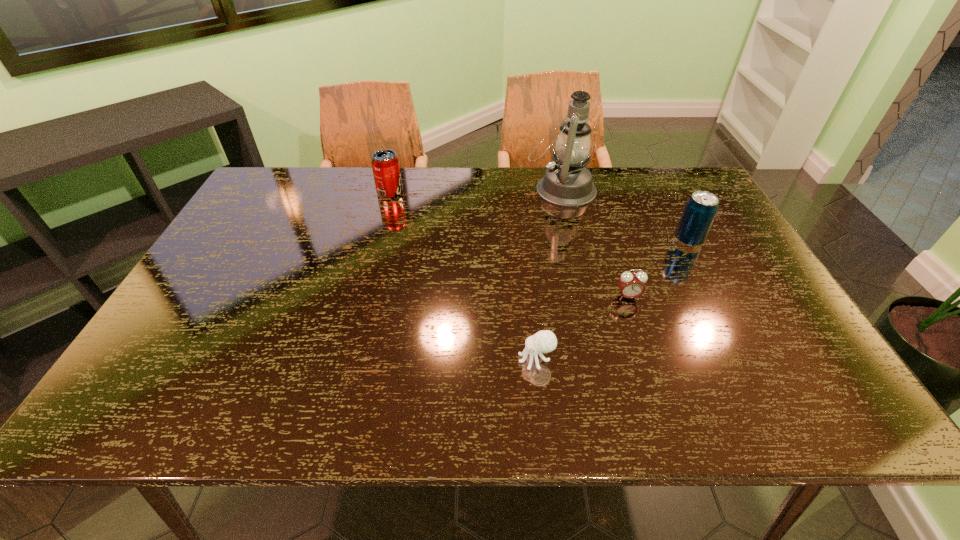
The width and height of the screenshot is (960, 540). What are the coordinates of `vacant space at the far left corner of the desktop` in the screenshot? It's located at [x=289, y=182].

The height and width of the screenshot is (540, 960). Identify the location of vacant space at the near left corner of the desktop. (144, 408).

The image size is (960, 540). I want to click on free space between the fourth farthest object and the farther soda can, so click(509, 245).

Locate an element on the screen. vacant space that is in between the alarm clock and the nearer soda can is located at coordinates (659, 268).

Where is `free space that is in between the left soda can and the tallest object`? Image resolution: width=960 pixels, height=540 pixels. free space that is in between the left soda can and the tallest object is located at coordinates [x=475, y=191].

Identify the location of empty space between the farther soda can and the octopus. The width and height of the screenshot is (960, 540). (463, 276).

Image resolution: width=960 pixels, height=540 pixels. In order to click on vacant point located between the leftmost object and the nearest object in this screenshot , I will do `click(463, 276)`.

Identify the location of vacant area that lies between the oil lamp and the left soda can. The height and width of the screenshot is (540, 960). (475, 191).

Find the location of a particular element. This screenshot has height=540, width=960. free space between the left soda can and the oil lamp is located at coordinates (475, 191).

Identify the location of free space between the farther soda can and the fourth farthest object. (509, 245).